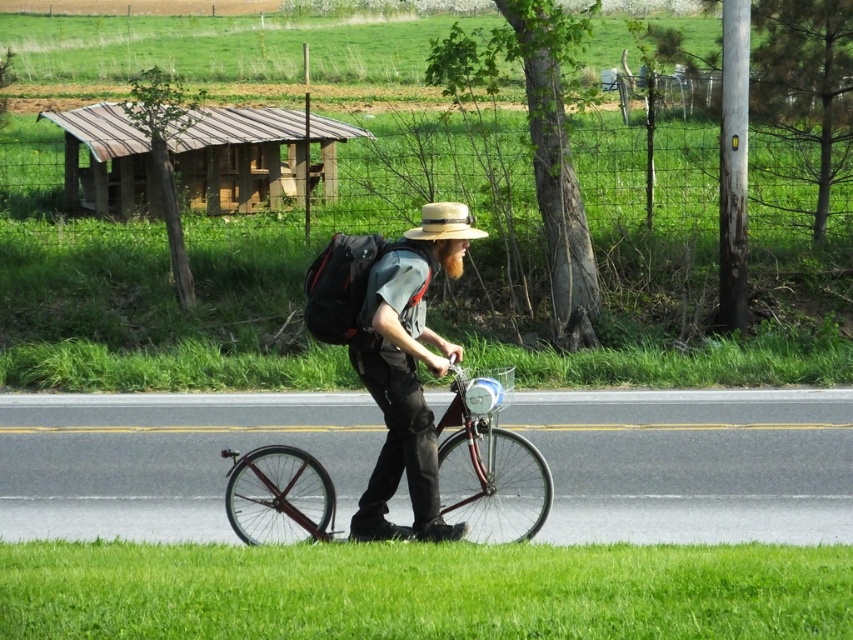
You are a photographer planning to take a photo of the shiny red bicycle at center and the woven straw hat at center. Which object should you focus on first if you want to capture both in a single shot without zooming in or out?

The shiny red bicycle at center is bigger than the woven straw hat at center, so you should focus on the shiny red bicycle at center first to ensure it fits properly in the frame before adjusting for the smaller woven straw hat at center.

You are a photographer trying to capture the scene with the shiny red bicycle at center and the woven straw hat at center. Which object should you focus on first if you want to include both in your shot without moving the camera?

You should focus on the woven straw hat at center first because the shiny red bicycle at center is to the right of it, so adjusting the frame to include both would require ensuring the hat is centered while the bicycle remains within the shot to the right.

You are a drone operator trying to capture the perfect shot of the person riding the bicycle. The drone is currently at a position above the scene. To ensure the matte brown hat at center is in the frame, where should you position the drone relative to the hat?

The matte brown hat at center is located at point 0.580 on the x axis and 0.478 on the y axis, so the drone should be positioned above this coordinate to capture the hat in the frame.